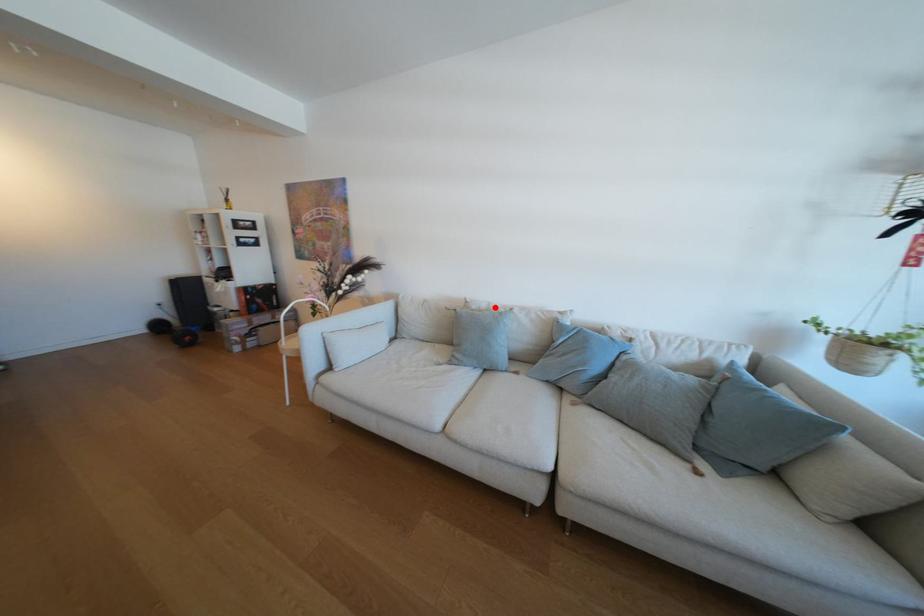
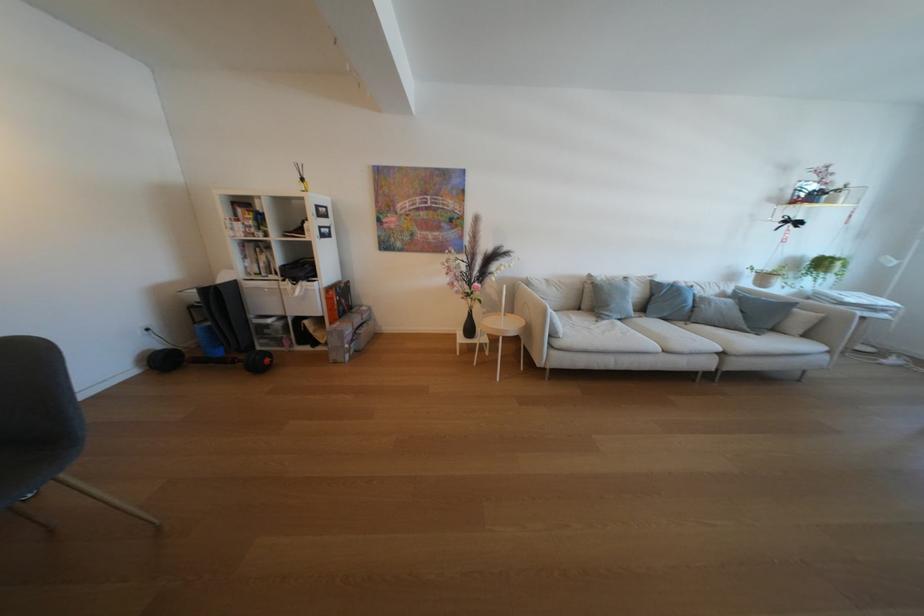
Where in the second image is the point corresponding to the highlighted location from the first image?

(614, 278)